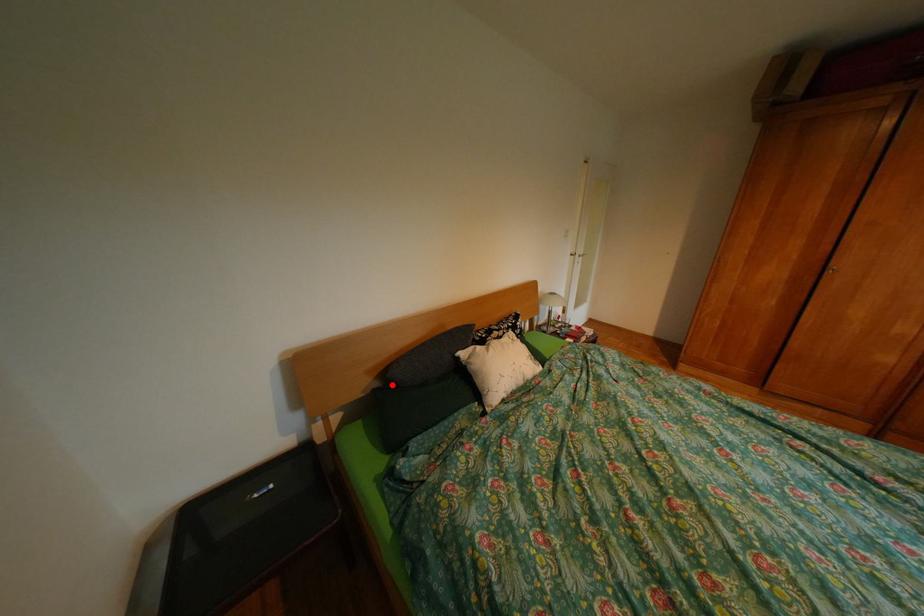
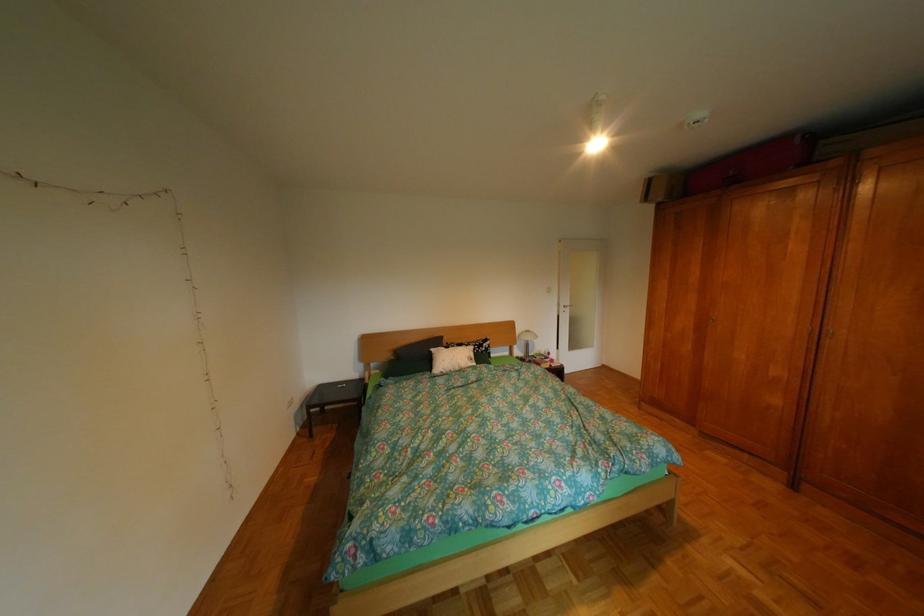
The point at the highlighted location is marked in the first image. Where is the corresponding point in the second image?

(407, 359)